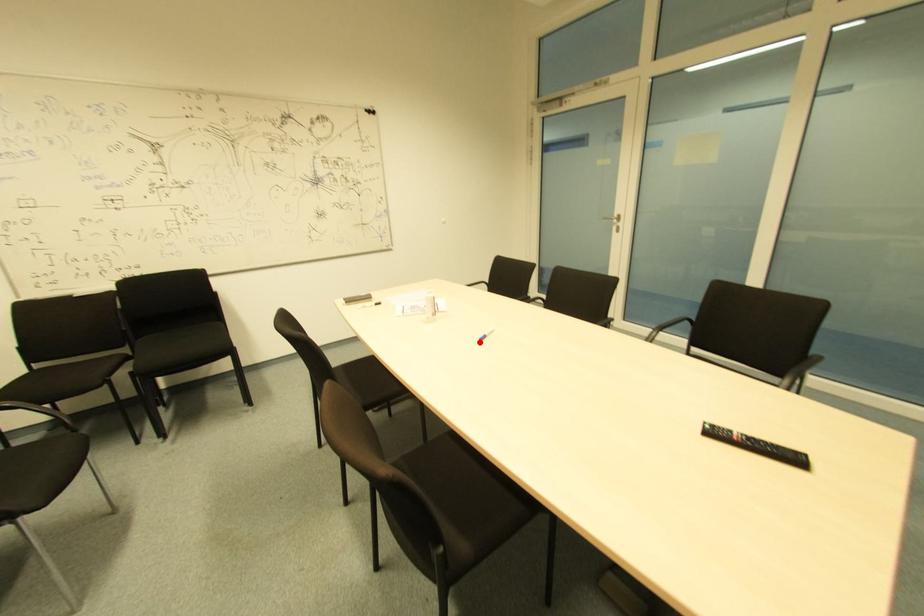
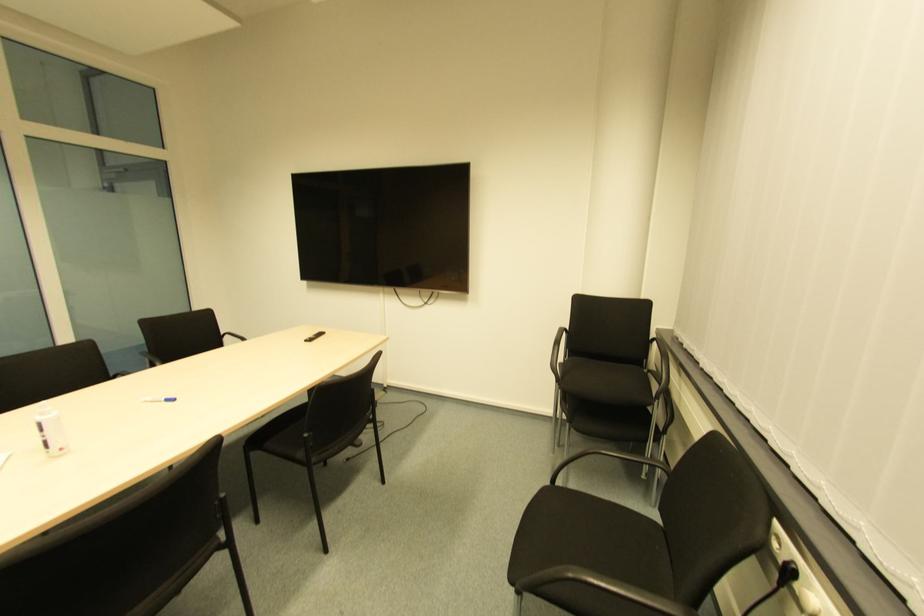
Where in the second image is the point corresponding to the highlighted location from the first image?

(172, 403)